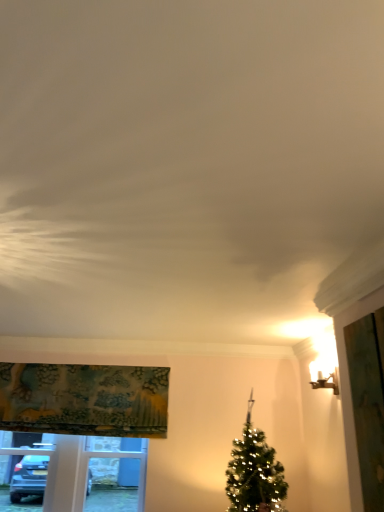
Question: Is textured fabric curtain at upper left shorter than matte gold sconce at upper right?

Choices:
 (A) no
 (B) yes

Answer: (A)

Question: From the image's perspective, would you say textured fabric curtain at upper left is shown under matte gold sconce at upper right?

Choices:
 (A) no
 (B) yes

Answer: (B)

Question: Does textured fabric curtain at upper left appear on the right side of matte gold sconce at upper right?

Choices:
 (A) yes
 (B) no

Answer: (B)

Question: From the image's perspective, is textured fabric curtain at upper left on top of matte gold sconce at upper right?

Choices:
 (A) no
 (B) yes

Answer: (A)

Question: Does textured fabric curtain at upper left have a lesser width compared to matte gold sconce at upper right?

Choices:
 (A) yes
 (B) no

Answer: (B)

Question: From a real-world perspective, is textured fabric curtain at upper left located beneath matte gold sconce at upper right?

Choices:
 (A) no
 (B) yes

Answer: (B)

Question: Is white plastic window frame at lower left in front of textured fabric curtain at upper left?

Choices:
 (A) no
 (B) yes

Answer: (A)

Question: Can you confirm if white plastic window frame at lower left is thinner than textured fabric curtain at upper left?

Choices:
 (A) yes
 (B) no

Answer: (A)

Question: Is white plastic window frame at lower left oriented towards textured fabric curtain at upper left?

Choices:
 (A) no
 (B) yes

Answer: (A)

Question: Is white plastic window frame at lower left at the right side of textured fabric curtain at upper left?

Choices:
 (A) no
 (B) yes

Answer: (A)

Question: From the image's perspective, is white plastic window frame at lower left under textured fabric curtain at upper left?

Choices:
 (A) yes
 (B) no

Answer: (A)

Question: Is white plastic window frame at lower left completely or partially outside of textured fabric curtain at upper left?

Choices:
 (A) no
 (B) yes

Answer: (B)

Question: Is green fabric screen door at right at the left side of textured fabric curtain at upper left?

Choices:
 (A) no
 (B) yes

Answer: (A)